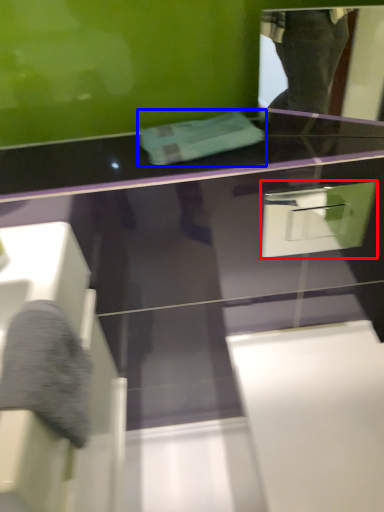
Question: Which object appears farthest to the camera in this image, drawer (highlighted by a red box) or towel (highlighted by a blue box)?

Choices:
 (A) drawer
 (B) towel

Answer: (B)